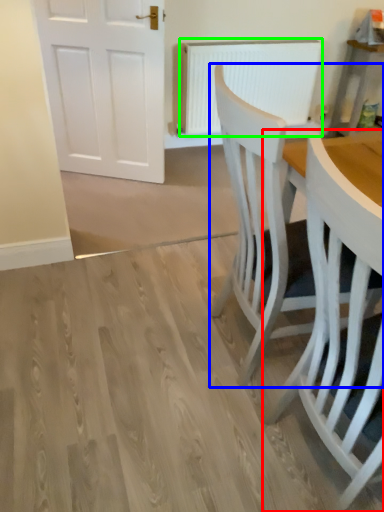
Question: Based on their relative distances, which object is farther from chair (highlighted by a red box)? Choose from chair (highlighted by a blue box) and radiator (highlighted by a green box).

Choices:
 (A) chair
 (B) radiator

Answer: (B)